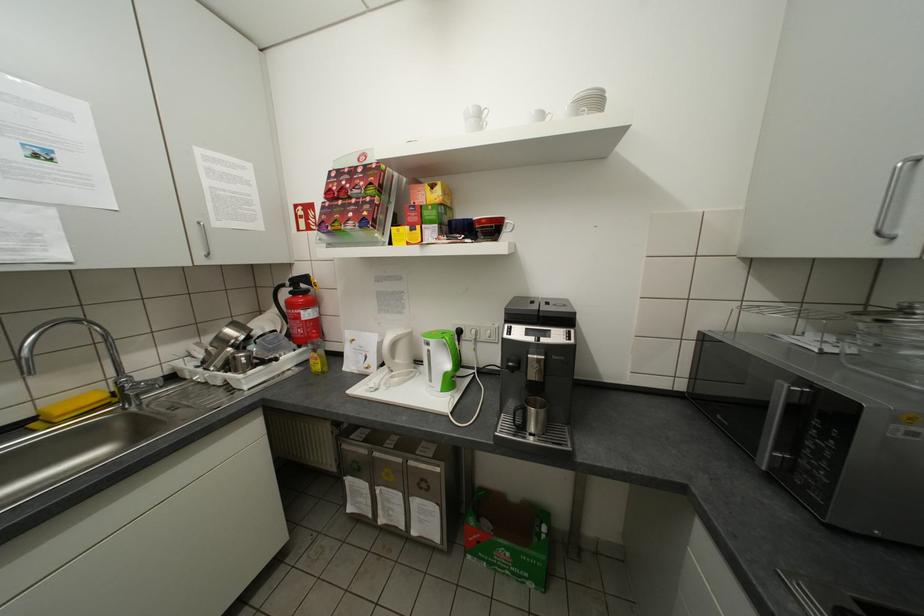
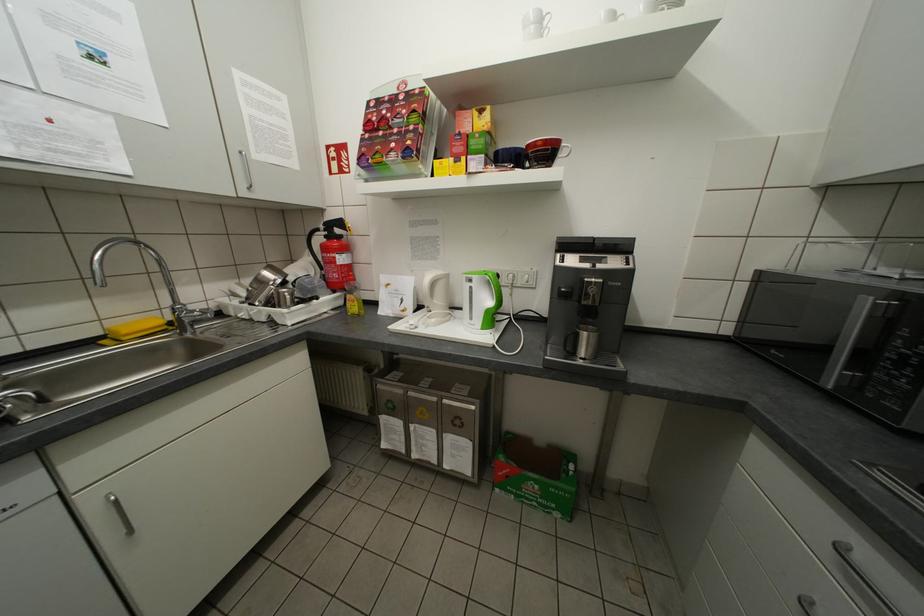
In the second image, find the point that corresponds to the point at 551,116 in the first image.

(623, 17)